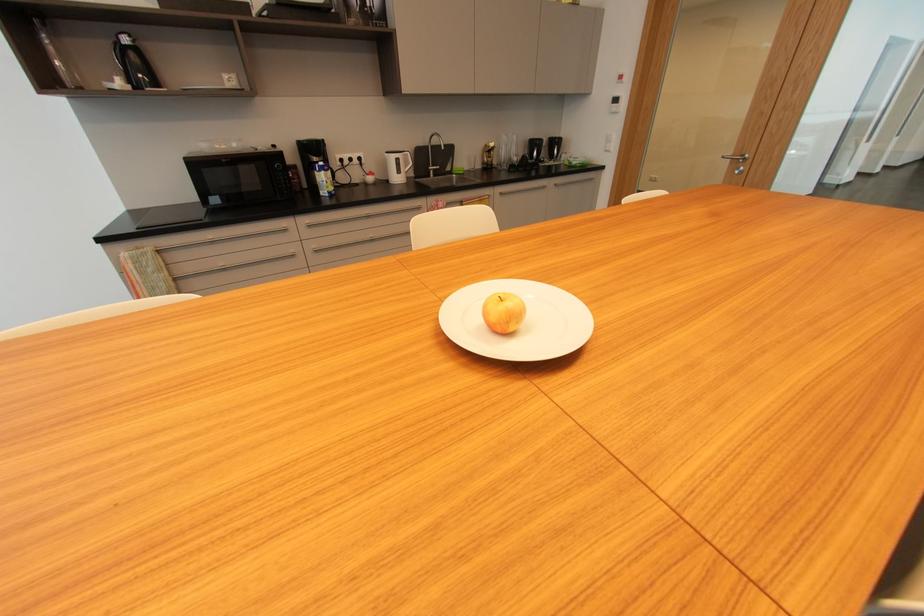
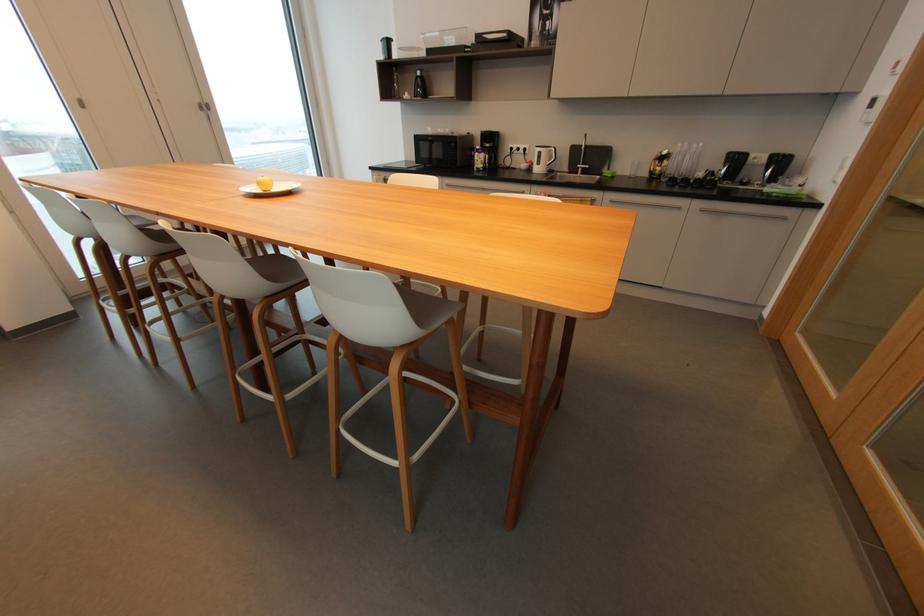
Find the pixel in the second image that matches [548,188] in the first image.

(683, 208)